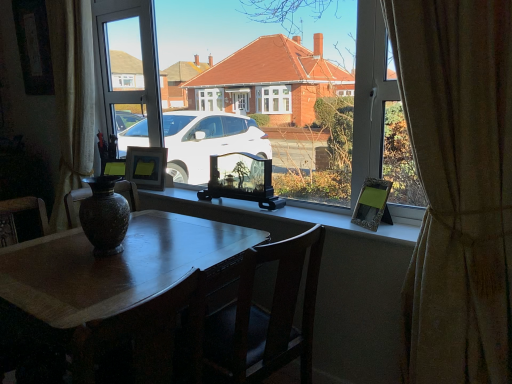
Question: From the image's perspective, is wooden chair at center under matte glass photo frame at center?

Choices:
 (A) no
 (B) yes

Answer: (B)

Question: Can we say wooden chair at center lies outside matte glass photo frame at center?

Choices:
 (A) yes
 (B) no

Answer: (A)

Question: Can you confirm if wooden chair at center is thinner than matte glass photo frame at center?

Choices:
 (A) no
 (B) yes

Answer: (A)

Question: Considering the relative sizes of wooden chair at center and matte glass photo frame at center in the image provided, is wooden chair at center smaller than matte glass photo frame at center?

Choices:
 (A) no
 (B) yes

Answer: (A)

Question: Is wooden chair at center turned away from matte glass photo frame at center?

Choices:
 (A) no
 (B) yes

Answer: (A)

Question: Is wooden chair at center at the right side of matte glass photo frame at center?

Choices:
 (A) no
 (B) yes

Answer: (B)

Question: From a real-world perspective, is metallic silver picture frame at right, which appears as the 3th picture frame when viewed from the back, over matte glass photo frame at center?

Choices:
 (A) no
 (B) yes

Answer: (B)

Question: Could you tell me if metallic silver picture frame at right, arranged as the third picture frame when viewed from the left, is facing matte glass photo frame at center?

Choices:
 (A) no
 (B) yes

Answer: (A)

Question: Is matte glass photo frame at center located within metallic silver picture frame at right, which appears as the 3th picture frame when viewed from the back?

Choices:
 (A) no
 (B) yes

Answer: (A)

Question: Considering the relative sizes of metallic silver picture frame at right, arranged as the third picture frame when viewed from the left, and matte glass photo frame at center in the image provided, is metallic silver picture frame at right, arranged as the third picture frame when viewed from the left, taller than matte glass photo frame at center?

Choices:
 (A) yes
 (B) no

Answer: (A)

Question: Would you consider metallic silver picture frame at right, which appears as the 3th picture frame when viewed from the back, to be distant from matte glass photo frame at center?

Choices:
 (A) yes
 (B) no

Answer: (B)

Question: From the image's perspective, is metallic silver picture frame at right, acting as the 1th picture frame starting from the front, under matte glass photo frame at center?

Choices:
 (A) no
 (B) yes

Answer: (A)

Question: From a real-world perspective, is metallic silver picture frame at right, the 1th picture frame in the right-to-left sequence, positioned over marbled stone vase at center based on gravity?

Choices:
 (A) no
 (B) yes

Answer: (A)